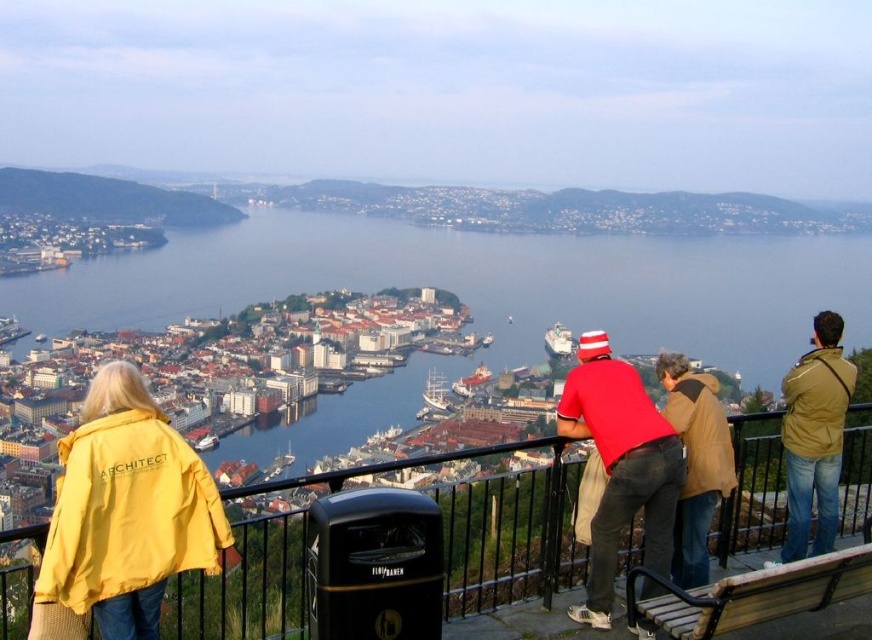
You are standing at the scenic overlook and want to take a photo of the harbor while ensuring the black metal railing at upper center does not block the view. Based on its position, can you position yourself to the left or right of the railing to avoid it?

The black metal railing at upper center is located at point 0.853 on the x and 0.509 on the y coordinate. To avoid blocking the view of the harbor, you should position yourself to the left of the railing since it is positioned towards the right side of the frame.

You are standing at the overlook and want to take a photo of the blue water at center and the red cotton shirt at center. Which object should you frame first in your camera viewfinder to ensure both are in the shot?

You should frame the blue water at center first since it is positioned to the left of the red cotton shirt at center, ensuring both are included in the shot.

You are a photographer standing at the overlook and want to capture both the red cotton shirt at center and the brown leather jacket at center in the same frame. Which person should you position closer to the center of your camera to ensure both are fully visible?

The red cotton shirt at center might be wider than brown leather jacket at center, so positioning the red cotton shirt at center closer to the center of the camera would help ensure both are fully visible in the frame.